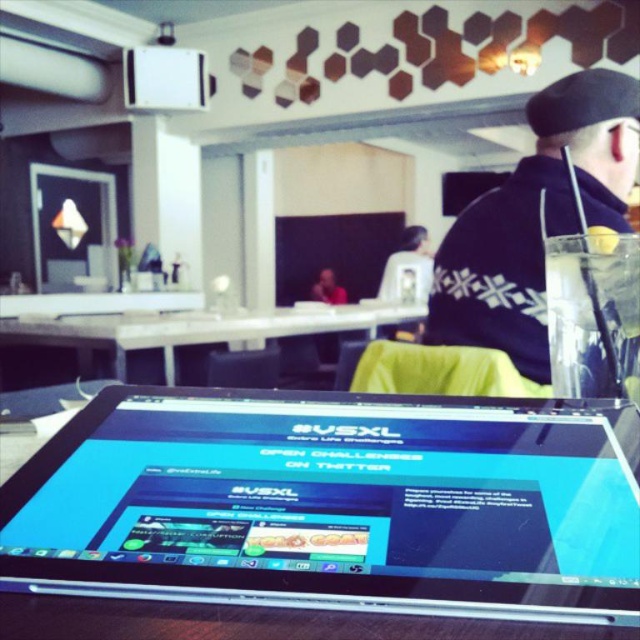
Question: Can you confirm if dark blue sweater at upper right is wider than smooth skin person at center?

Choices:
 (A) no
 (B) yes

Answer: (B)

Question: Which point is farther from the camera taking this photo?

Choices:
 (A) (339, 296)
 (B) (356, 321)

Answer: (A)

Question: Is dark blue sweater at upper right in front of smooth skin person at center?

Choices:
 (A) no
 (B) yes

Answer: (B)

Question: Which of the following is the closest to the observer?

Choices:
 (A) (77, 324)
 (B) (420, 493)

Answer: (B)

Question: Considering the real-world distances, which object is farthest from the white glossy table at center?

Choices:
 (A) smooth skin person at center
 (B) dark blue sweater at upper right

Answer: (B)

Question: Is silver metallic tablet at center to the right of smooth skin person at center from the viewer's perspective?

Choices:
 (A) yes
 (B) no

Answer: (A)